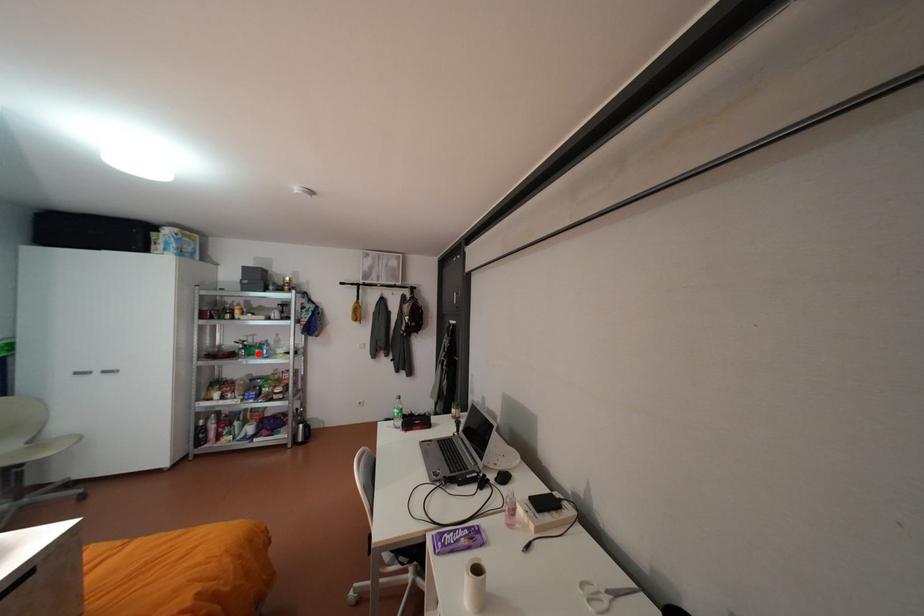
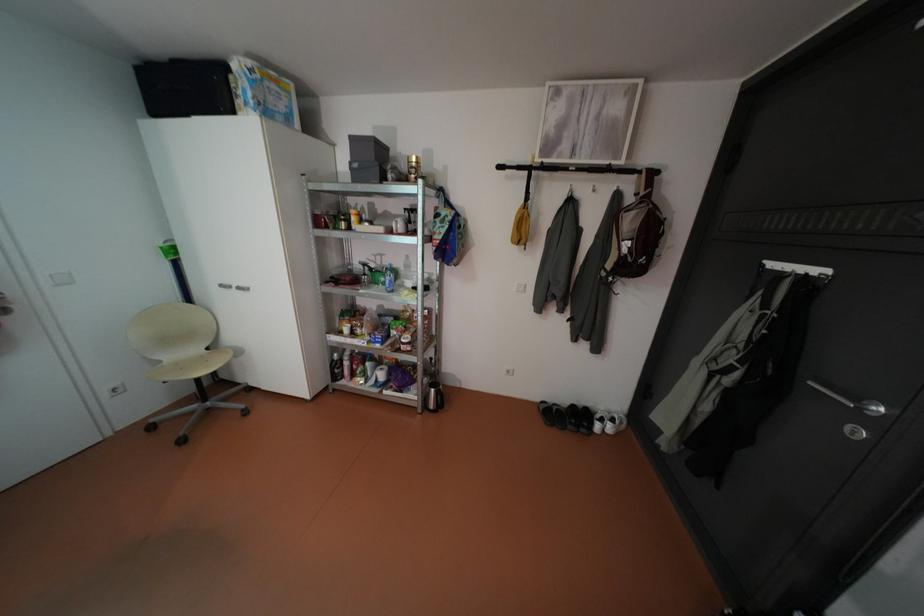
Question: I am providing you with two images of the same scene from different viewpoints. A red point is shown in image1. For the corresponding object point in image2, is it positioned nearer or farther from the camera?

Choices:
 (A) Nearer
 (B) Farther

Answer: (A)